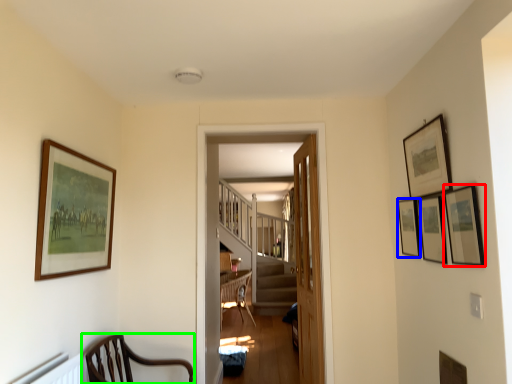
Question: Which object is positioned closest to picture frame (highlighted by a red box)? Select from picture frame (highlighted by a blue box) and chair (highlighted by a green box).

Choices:
 (A) picture frame
 (B) chair

Answer: (A)